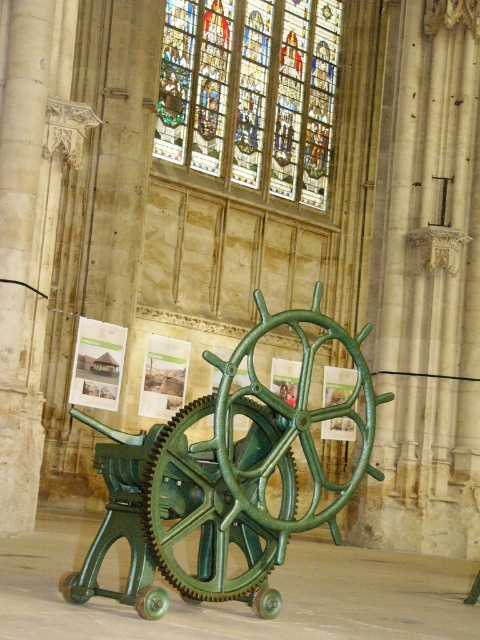
Question: Does green polished metal gear at center have a larger size compared to stained glass at upper center?

Choices:
 (A) no
 (B) yes

Answer: (A)

Question: Which point is closer to the camera?

Choices:
 (A) green polished metal gear at center
 (B) stained glass at upper center

Answer: (A)

Question: Which point is farther to the camera?

Choices:
 (A) (287, 484)
 (B) (184, 92)

Answer: (B)

Question: Which point is farther from the camera taking this photo?

Choices:
 (A) (324, 20)
 (B) (289, 449)

Answer: (A)

Question: Is green polished metal gear at center wider than stained glass at upper center?

Choices:
 (A) no
 (B) yes

Answer: (A)

Question: Does green polished metal gear at center have a smaller size compared to stained glass at upper center?

Choices:
 (A) no
 (B) yes

Answer: (B)